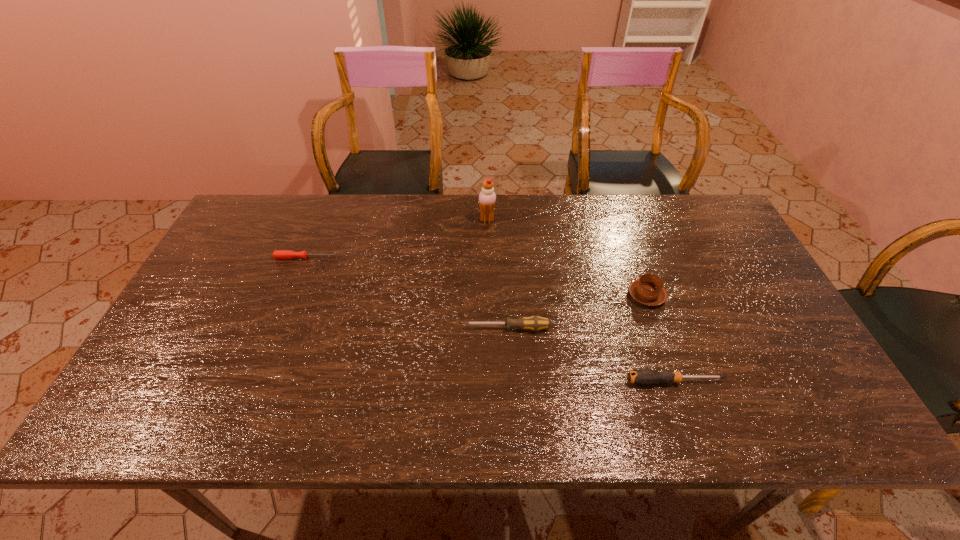
At what (x,y) coordinates should I click in order to perform the action: click on free point located 0.380m at the tip of the leftmost screwdriver. Please return your answer as a coordinate pair (x, y). Looking at the image, I should click on (466, 258).

In order to click on object at the far edge in this screenshot , I will do `click(487, 197)`.

This screenshot has height=540, width=960. In the image, there is a desktop. Identify the location of free space at the far edge. (324, 200).

At what (x,y) coordinates should I click in order to perform the action: click on free region at the near edge. Please return your answer as a coordinate pair (x, y). This screenshot has height=540, width=960. Looking at the image, I should click on (590, 435).

Image resolution: width=960 pixels, height=540 pixels. Identify the location of free location at the left edge of the desktop. (174, 348).

Where is `free space at the right edge of the desktop`? This screenshot has width=960, height=540. free space at the right edge of the desktop is located at coordinates (771, 327).

In the image, there is a desktop. At what (x,y) coordinates should I click in order to perform the action: click on free space at the far right corner. Please return your answer as a coordinate pair (x, y). This screenshot has width=960, height=540. Looking at the image, I should click on (708, 210).

Identify the location of vacant area that lies between the second nearest object and the rightmost screwdriver. The width and height of the screenshot is (960, 540). (591, 355).

The width and height of the screenshot is (960, 540). In order to click on vacant space that is in between the second nearest object and the leftmost screwdriver in this screenshot , I will do `click(407, 293)`.

Where is `empty location between the second screwdriver from right to left and the shortest object`? Image resolution: width=960 pixels, height=540 pixels. empty location between the second screwdriver from right to left and the shortest object is located at coordinates pyautogui.click(x=407, y=293).